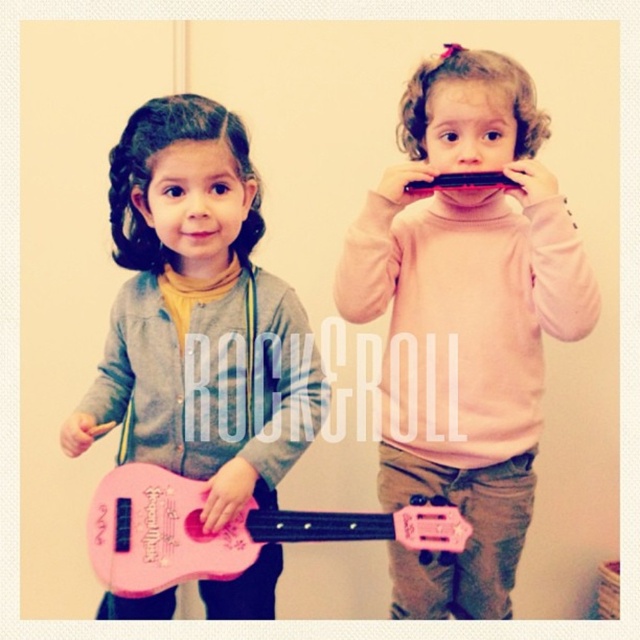
Is pink plastic guitar at left below pink matte guitar at center?

No, pink plastic guitar at left is not below pink matte guitar at center.

Can you confirm if pink plastic guitar at left is thinner than pink matte guitar at center?

Yes, pink plastic guitar at left is thinner than pink matte guitar at center.

Is point (204, 330) positioned in front of point (125, 516)?

No, it is not.

You are a GUI agent. You are given a task and a screenshot of the screen. Output one action in this format:
    pyautogui.click(x=<x>, y=<y>)
    Task: Click on the pink plastic guitar at left
    The image size is (640, 640).
    Given the screenshot: What is the action you would take?
    pyautogui.click(x=198, y=316)

Between pink plastic guitar at center and pink matte guitar at center, which one has less height?

Standing shorter between the two is pink matte guitar at center.

Is point (548, 179) positioned after point (193, 481)?

That is True.

In order to click on pink plastic guitar at center in this screenshot , I will do `click(465, 321)`.

Consider the image. Can you confirm if pink plastic guitar at center is bigger than pink plastic guitar at left?

Yes, pink plastic guitar at center is bigger than pink plastic guitar at left.

From the picture: Which is above, pink plastic guitar at center or pink plastic guitar at left?

pink plastic guitar at center

In the scene shown: Who is more distant from viewer, [540,214] or [284,323]?

The point [284,323] is behind.

The image size is (640, 640). Identify the location of pink plastic guitar at center. (465, 321).